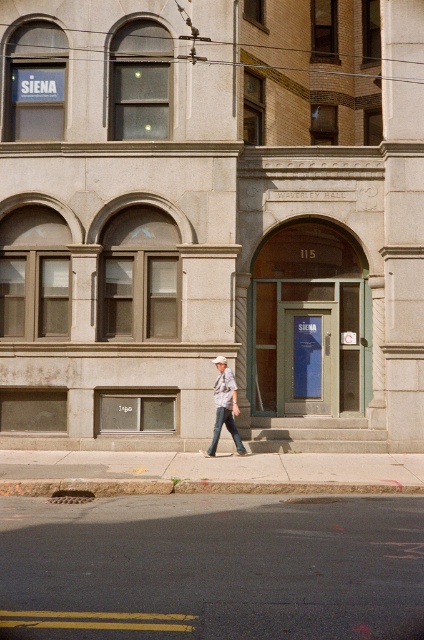
You are standing at the entrance of Waverley Hall and want to determine which of the two points, point (153, 560) or point (225, 365), is closer to you. Which point should you choose?

Point (153, 560) is closer to the viewer than point (225, 365), so you should choose point (153, 560).